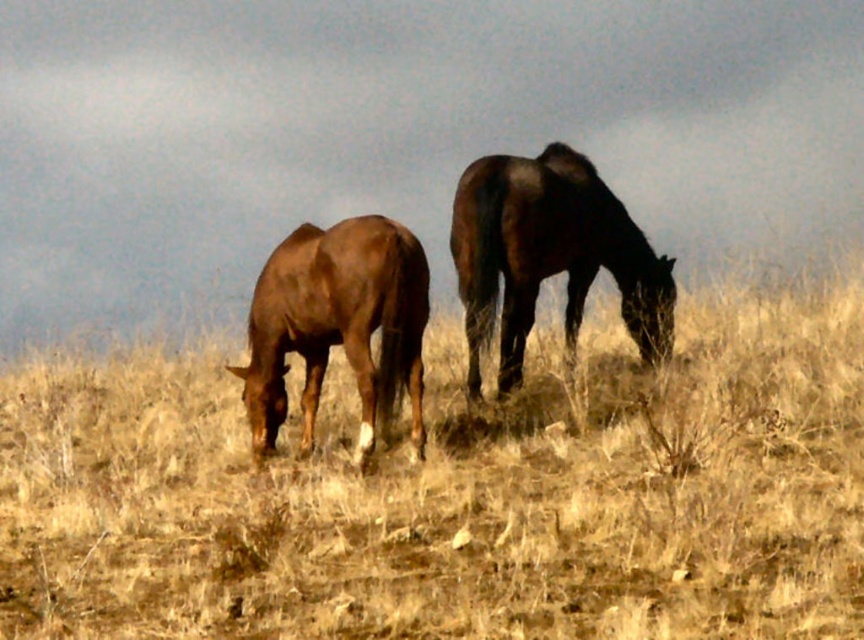
Question: Where is shiny dark brown horse at center located in relation to brown glossy horse at left in the image?

Choices:
 (A) above
 (B) below

Answer: (A)

Question: Among these points, which one is nearest to the camera?

Choices:
 (A) [x=372, y=429]
 (B) [x=706, y=547]
 (C) [x=469, y=310]

Answer: (B)

Question: Does shiny dark brown horse at center lie in front of brown glossy horse at left?

Choices:
 (A) no
 (B) yes

Answer: (A)

Question: Does brown grassy at center lie in front of brown glossy horse at left?

Choices:
 (A) yes
 (B) no

Answer: (A)

Question: Which object appears farthest from the camera in this image?

Choices:
 (A) shiny dark brown horse at center
 (B) brown glossy horse at left
 (C) brown grassy at center

Answer: (A)

Question: Based on their relative distances, which object is farther from the shiny dark brown horse at center?

Choices:
 (A) brown grassy at center
 (B) brown glossy horse at left

Answer: (A)